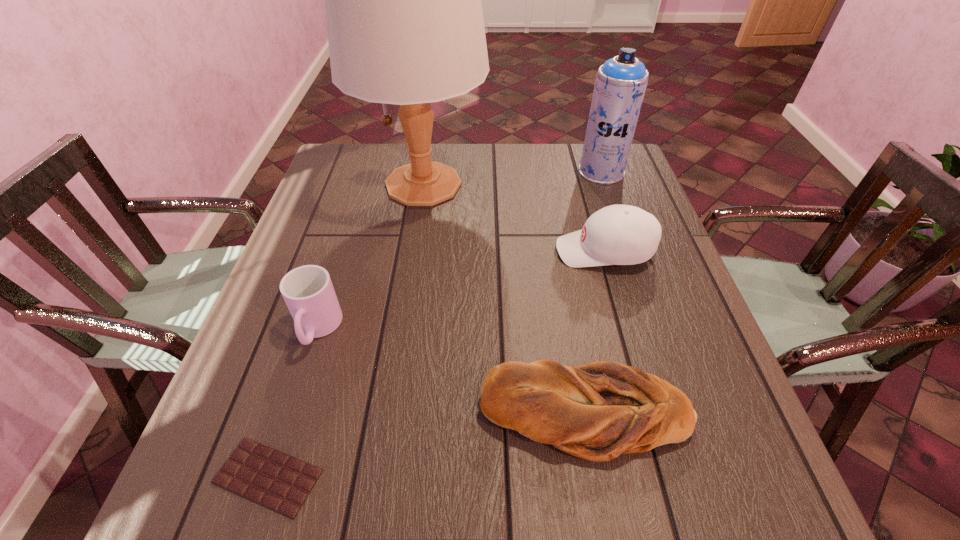
Where is `vacant area situated on the front-facing side of the baseball cap`? This screenshot has height=540, width=960. vacant area situated on the front-facing side of the baseball cap is located at coordinates (511, 251).

Find the location of a particular element. The height and width of the screenshot is (540, 960). vacant area situated on the front-facing side of the baseball cap is located at coordinates (462, 251).

You are a GUI agent. You are given a task and a screenshot of the screen. Output one action in this format:
    pyautogui.click(x=<x>, y=<y>)
    Task: Click on the free space located 0.340m on the back of the fifth tallest object
    The height and width of the screenshot is (540, 960).
    Given the screenshot: What is the action you would take?
    pyautogui.click(x=557, y=251)

Where is `free space located 0.170m on the back of the shortest object`? The height and width of the screenshot is (540, 960). free space located 0.170m on the back of the shortest object is located at coordinates (307, 354).

Find the location of a particular element. table lamp at the far edge is located at coordinates (405, 25).

Identify the location of aerosol can situated at the far edge. (620, 84).

Image resolution: width=960 pixels, height=540 pixels. I want to click on bread that is at the near edge, so click(596, 411).

I want to click on chocolate bar at the near edge, so [278, 481].

This screenshot has width=960, height=540. I want to click on table lamp that is at the left edge, so click(x=405, y=25).

You are a GUI agent. You are given a task and a screenshot of the screen. Output one action in this format:
    pyautogui.click(x=<x>, y=<y>)
    Task: Click on the cup present at the left edge
    The height and width of the screenshot is (540, 960).
    Given the screenshot: What is the action you would take?
    (x=308, y=292)